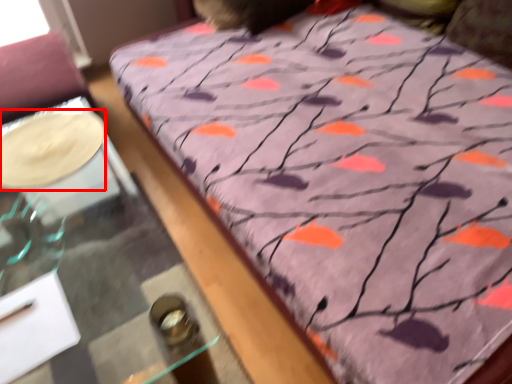
Question: Considering the relative positions of glass plate (annotated by the red box) and table in the image provided, where is glass plate (annotated by the red box) located with respect to the staircase?

Choices:
 (A) right
 (B) left

Answer: (B)